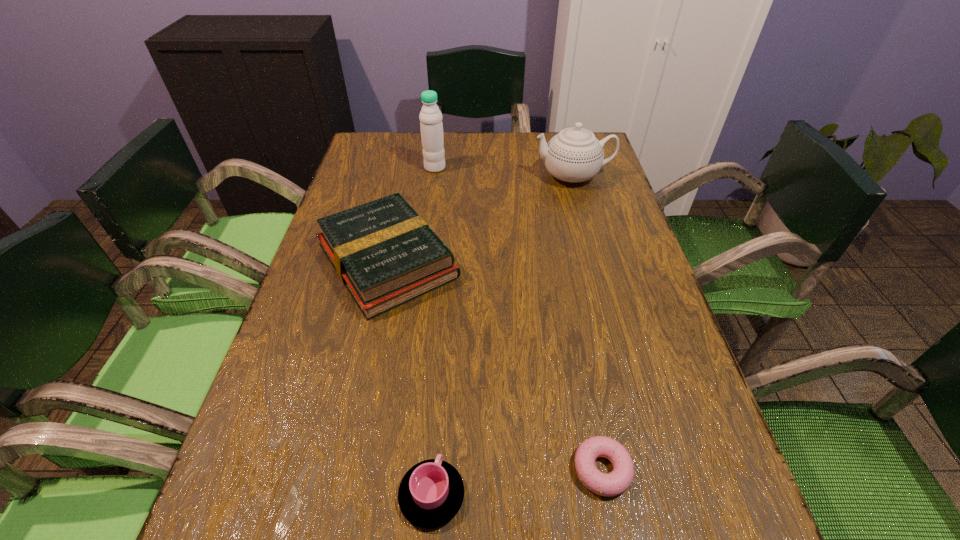
Find the location of a particular element. The width and height of the screenshot is (960, 540). water bottle is located at coordinates (430, 117).

This screenshot has height=540, width=960. Identify the location of chinaware. (574, 155).

Locate an element on the screen. Image resolution: width=960 pixels, height=540 pixels. hardback book is located at coordinates (385, 254).

Locate an element on the screen. The width and height of the screenshot is (960, 540). the third farthest object is located at coordinates (385, 254).

The width and height of the screenshot is (960, 540). Find the location of `cup`. cup is located at coordinates (431, 493).

The width and height of the screenshot is (960, 540). Find the location of `doughnut`. doughnut is located at coordinates tap(616, 482).

Image resolution: width=960 pixels, height=540 pixels. I want to click on vacant region located on the front of the tallest object, so click(428, 217).

I want to click on free space located 0.150m on the spout of the second tallest object, so click(x=482, y=176).

Identify the location of vacant region located 0.160m on the spout of the second tallest object. (479, 176).

What are the coordinates of `vacant area situated 0.340m on the spout of the second tallest object` in the screenshot? It's located at (418, 176).